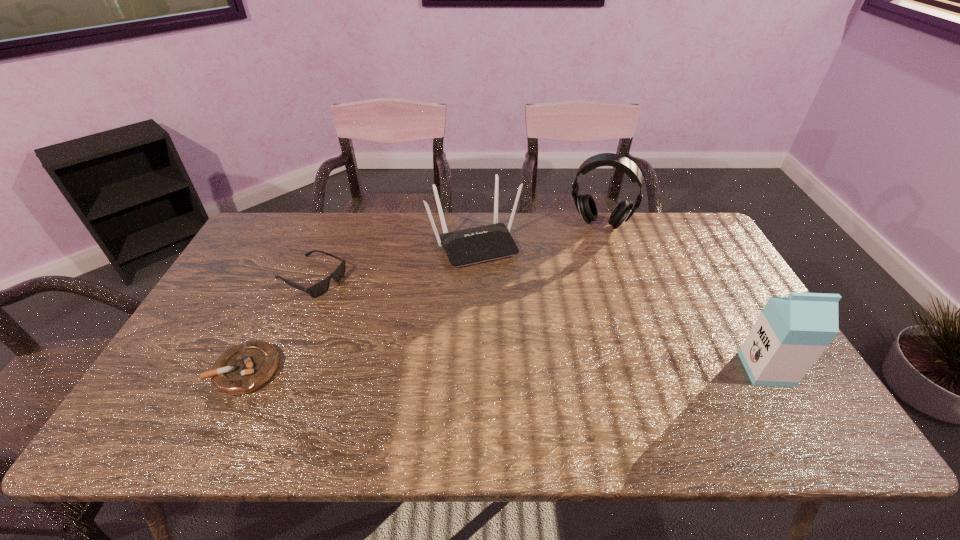
Find the location of a particular element. The height and width of the screenshot is (540, 960). free space at the far left corner of the desktop is located at coordinates (300, 235).

Where is `free space at the far right corner of the desktop`? This screenshot has height=540, width=960. free space at the far right corner of the desktop is located at coordinates (674, 219).

Locate an element on the screen. The height and width of the screenshot is (540, 960). vacant area at the near right corner is located at coordinates (763, 392).

Find the location of a particular element. The width and height of the screenshot is (960, 540). empty space that is in between the third shortest object and the rightmost object is located at coordinates (620, 306).

Where is `free spot between the fourth object from left to right and the milk carton`? The image size is (960, 540). free spot between the fourth object from left to right and the milk carton is located at coordinates (683, 297).

Where is `vacant area between the second object from right to left and the third object from right to left`? Image resolution: width=960 pixels, height=540 pixels. vacant area between the second object from right to left and the third object from right to left is located at coordinates (538, 234).

Locate an element on the screen. This screenshot has height=540, width=960. unoccupied area between the milk carton and the ashtray is located at coordinates (506, 369).

Find the location of a particular element. Image resolution: width=960 pixels, height=540 pixels. vacant space that's between the shortest object and the third tallest object is located at coordinates (361, 307).

Identify the location of vacant point located between the rightmost object and the sunglasses. (538, 324).

Locate an element on the screen. This screenshot has width=960, height=540. vacant area that lies between the rightmost object and the third object from right to left is located at coordinates (620, 306).